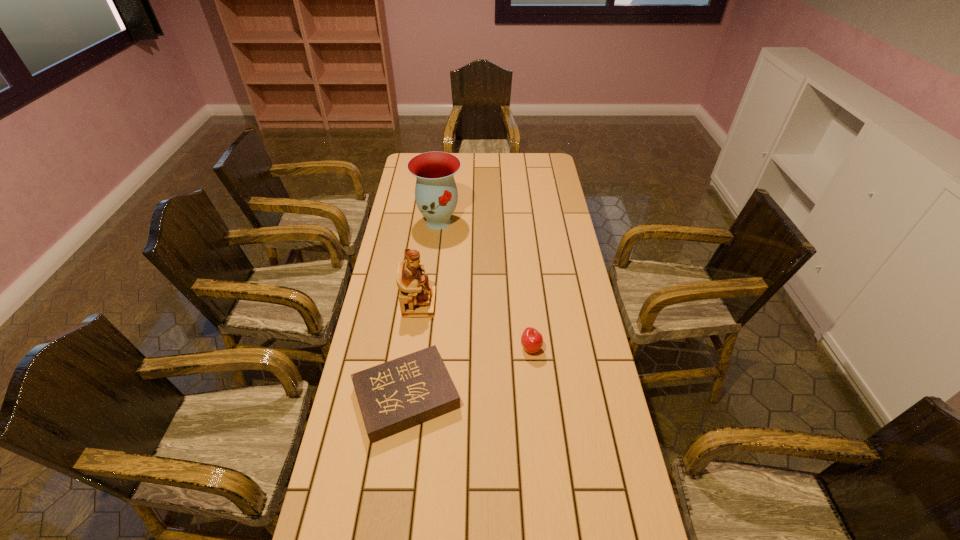
The image size is (960, 540). Find the location of `figurine situated at the left edge`. figurine situated at the left edge is located at coordinates click(x=417, y=298).

Where is `hardback book positioned at the left edge`? hardback book positioned at the left edge is located at coordinates (394, 396).

Locate an element on the screen. This screenshot has height=540, width=960. free region at the far edge of the desktop is located at coordinates (509, 175).

I want to click on free space at the left edge of the desktop, so click(396, 306).

Where is `vacant space at the right edge of the desktop`? vacant space at the right edge of the desktop is located at coordinates (548, 251).

At what (x,y) coordinates should I click in order to perform the action: click on free space between the figurine and the third tallest object. Please return your answer as a coordinate pair (x, y). Looking at the image, I should click on (475, 326).

Find the location of a particular element. Image resolution: width=960 pixels, height=540 pixels. vacant area that lies between the second farthest object and the apple is located at coordinates (475, 326).

This screenshot has width=960, height=540. I want to click on free space between the figurine and the farthest object, so click(429, 263).

Locate an element on the screen. The width and height of the screenshot is (960, 540). free spot between the rightmost object and the farthest object is located at coordinates (485, 285).

The height and width of the screenshot is (540, 960). Identify the location of vacant point located between the third nearest object and the rightmost object. (475, 326).